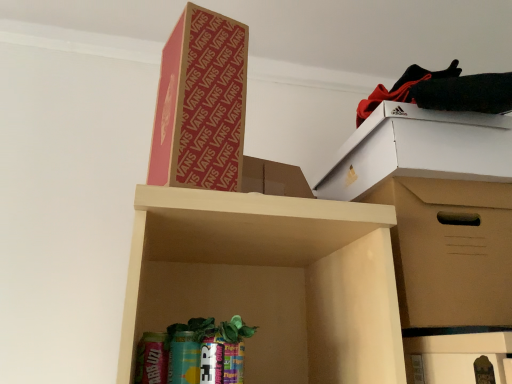
Question: Is cardboard box at upper center, which is the 2th cardboard box in bottom-to-top order, surrounded by black fabric at upper right?

Choices:
 (A) no
 (B) yes

Answer: (A)

Question: Is black fabric at upper right looking in the opposite direction of cardboard box at upper center, the second cardboard box when ordered from right to left?

Choices:
 (A) yes
 (B) no

Answer: (B)

Question: Is black fabric at upper right behind cardboard box at upper center, which is the 2th cardboard box in bottom-to-top order?

Choices:
 (A) no
 (B) yes

Answer: (B)

Question: From the image's perspective, does black fabric at upper right appear higher than cardboard box at upper center, the second cardboard box when ordered from right to left?

Choices:
 (A) no
 (B) yes

Answer: (B)

Question: Is black fabric at upper right to the right of cardboard box at upper center, the 1th cardboard box from the left, from the viewer's perspective?

Choices:
 (A) yes
 (B) no

Answer: (A)

Question: Is black fabric at upper right to the left of cardboard box at upper center, the 1th cardboard box from the left, from the viewer's perspective?

Choices:
 (A) yes
 (B) no

Answer: (B)

Question: Does brown cardboard box at right, arranged as the first cardboard box when viewed from the right, have a lesser width compared to cardboard box at upper center, positioned as the 1th cardboard box in top-to-bottom order?

Choices:
 (A) no
 (B) yes

Answer: (A)

Question: Is brown cardboard box at right, arranged as the first cardboard box when viewed from the right, turned away from cardboard box at upper center, which is the 2th cardboard box in bottom-to-top order?

Choices:
 (A) yes
 (B) no

Answer: (B)

Question: Is brown cardboard box at right, the first cardboard box when ordered from bottom to top, bigger than cardboard box at upper center, the second cardboard box when ordered from right to left?

Choices:
 (A) yes
 (B) no

Answer: (A)

Question: Is brown cardboard box at right, marked as the 2th cardboard box in a top-to-bottom arrangement, not within cardboard box at upper center, positioned as the 1th cardboard box in top-to-bottom order?

Choices:
 (A) yes
 (B) no

Answer: (A)

Question: From the image's perspective, is brown cardboard box at right, the 2th cardboard box in the left-to-right sequence, located beneath cardboard box at upper center, positioned as the 1th cardboard box in top-to-bottom order?

Choices:
 (A) no
 (B) yes

Answer: (B)

Question: From the image's perspective, is brown cardboard box at right, marked as the 2th cardboard box in a top-to-bottom arrangement, located above cardboard box at upper center, the second cardboard box when ordered from right to left?

Choices:
 (A) yes
 (B) no

Answer: (B)

Question: Is cardboard box at upper center, the second cardboard box when ordered from right to left, touching black fabric at upper right?

Choices:
 (A) yes
 (B) no

Answer: (B)